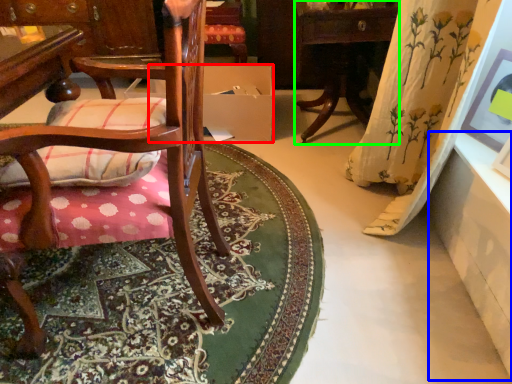
Question: Which object is positioned closest to cardboard box (highlighted by a red box)? Select from table (highlighted by a blue box) and table (highlighted by a green box).

Choices:
 (A) table
 (B) table

Answer: (B)